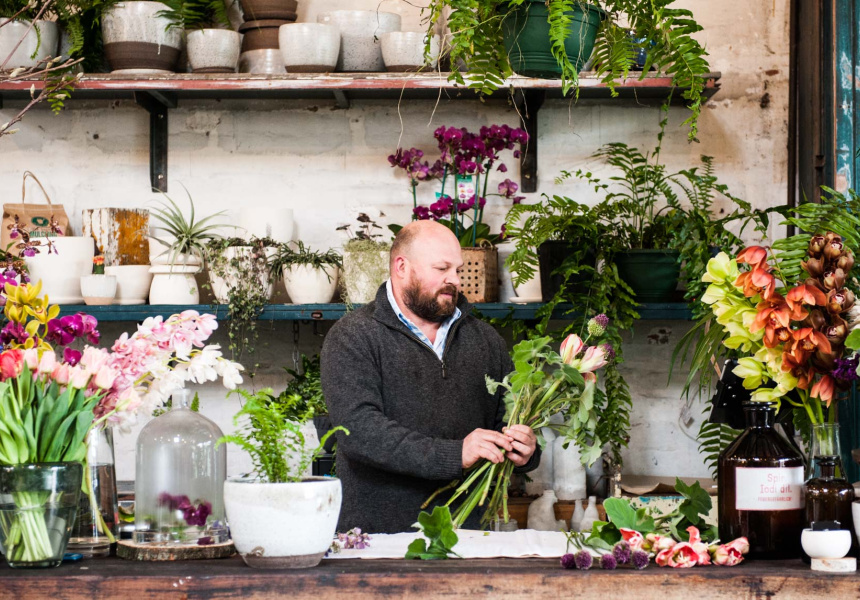
Where is `water in vase`? This screenshot has width=860, height=600. water in vase is located at coordinates (21, 539).